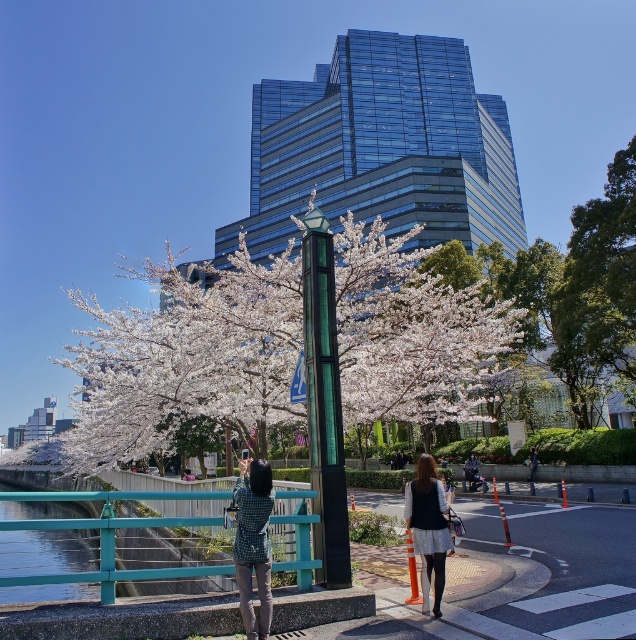
Question: Can you confirm if white blossoms at center is positioned to the left of checkered fabric shirt at center?

Choices:
 (A) yes
 (B) no

Answer: (A)

Question: Which point is farther from the camera taking this photo?

Choices:
 (A) (249, 634)
 (B) (506, 342)
 (C) (73, 593)
 (D) (415, 502)

Answer: (C)

Question: Is white blossoms at center to the left of green leafy tree at upper right from the viewer's perspective?

Choices:
 (A) no
 (B) yes

Answer: (B)

Question: Which of these objects is positioned closest to the denim jacket at center?

Choices:
 (A) checkered fabric shirt at center
 (B) white blossoms at center
 (C) green glass pole at center

Answer: (B)

Question: Which is nearer to the clear glass waterway at lower left?

Choices:
 (A) green glass pole at center
 (B) white blossoms at center

Answer: (B)

Question: Can you confirm if green leafy tree at upper right is positioned to the right of white textured skirt at center?

Choices:
 (A) yes
 (B) no

Answer: (A)